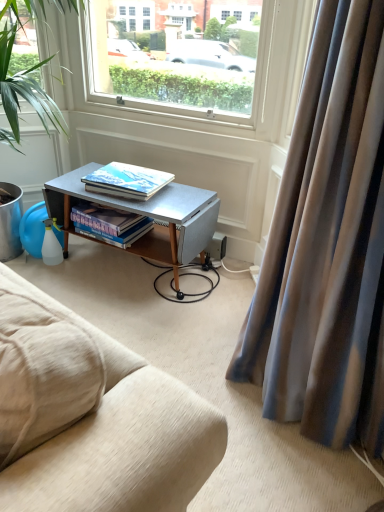
Question: Based on their positions, is matte hardcover book at center, the 2th book from the bottom, located to the left or right of metallic gray desk at center?

Choices:
 (A) left
 (B) right

Answer: (A)

Question: From the image's perspective, is matte hardcover book at center, the 2th book from the bottom, above or below metallic gray desk at center?

Choices:
 (A) above
 (B) below

Answer: (A)

Question: Which object is positioned farthest from the hardcover books at center, which is the 1th book in bottom-to-top order?

Choices:
 (A) satin fabric curtain at right
 (B) green leafy plant at left
 (C) matte hardcover book at center, the 2th book from the bottom
 (D) metallic gray desk at center

Answer: (A)

Question: Which is nearer to the satin fabric curtain at right?

Choices:
 (A) metallic gray desk at center
 (B) green leafy plant at left
 (C) matte hardcover book at center, the 2th book from the bottom
 (D) hardcover books at center, the 2th book viewed from the top

Answer: (A)